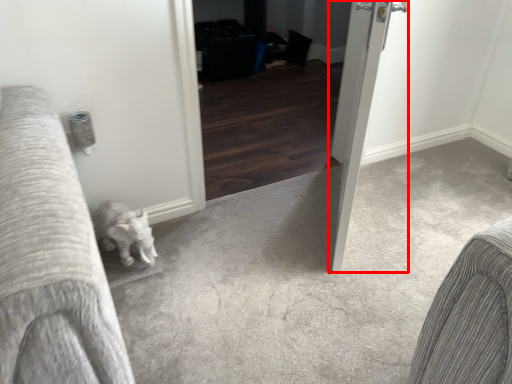
Question: From the image's perspective, what is the correct spatial relationship of door (annotated by the red box) in relation to screen door?

Choices:
 (A) below
 (B) above

Answer: (A)